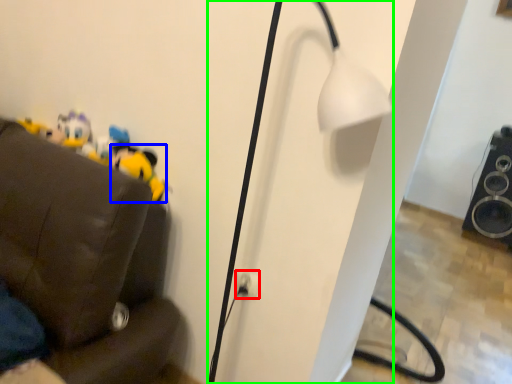
Question: Considering the real-world distances, which object is farthest from electric outlet (highlighted by a red box)? toy (highlighted by a blue box) or lamp (highlighted by a green box)?

Choices:
 (A) toy
 (B) lamp

Answer: (A)